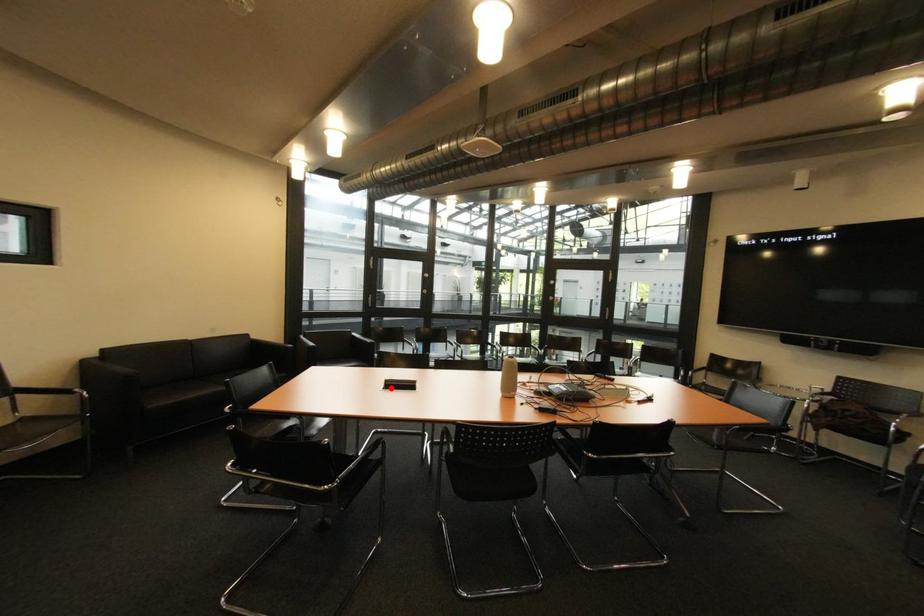
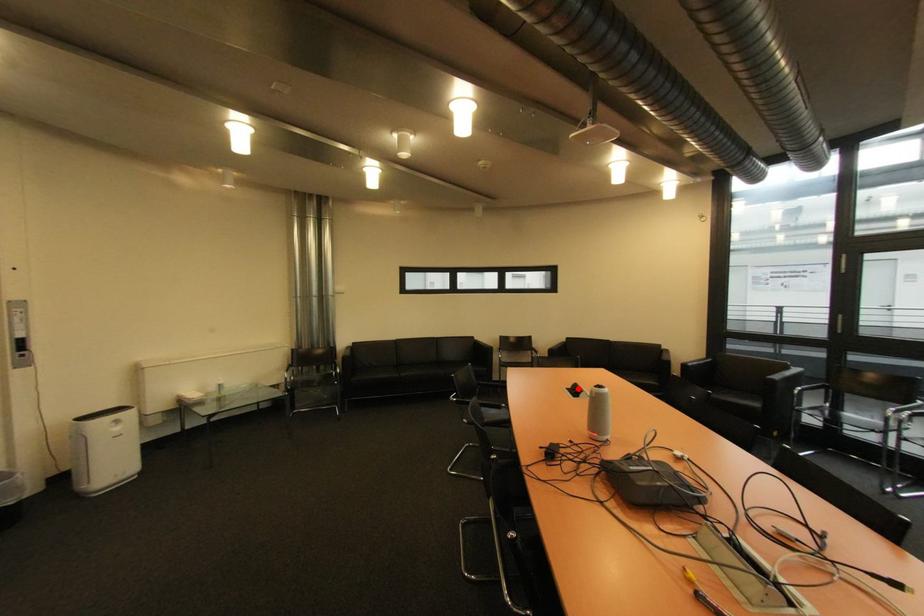
I am providing you with two images of the same scene from different viewpoints. A red point is marked on the first image and another point is marked on the second image. Do the highlighted points in image1 and image2 indicate the same real-world spot?

Yes